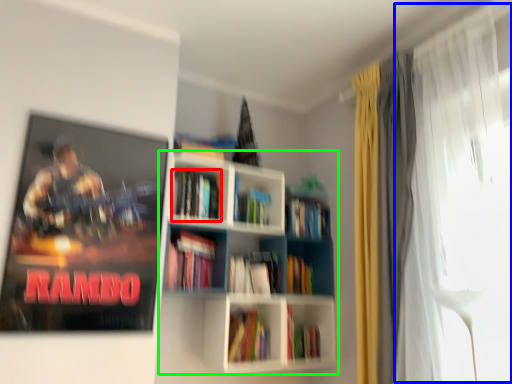
Question: Based on their relative distances, which object is nearer to book (highlighted by a red box)? Choose from window screen (highlighted by a blue box) and bookcase (highlighted by a green box).

Choices:
 (A) window screen
 (B) bookcase

Answer: (B)